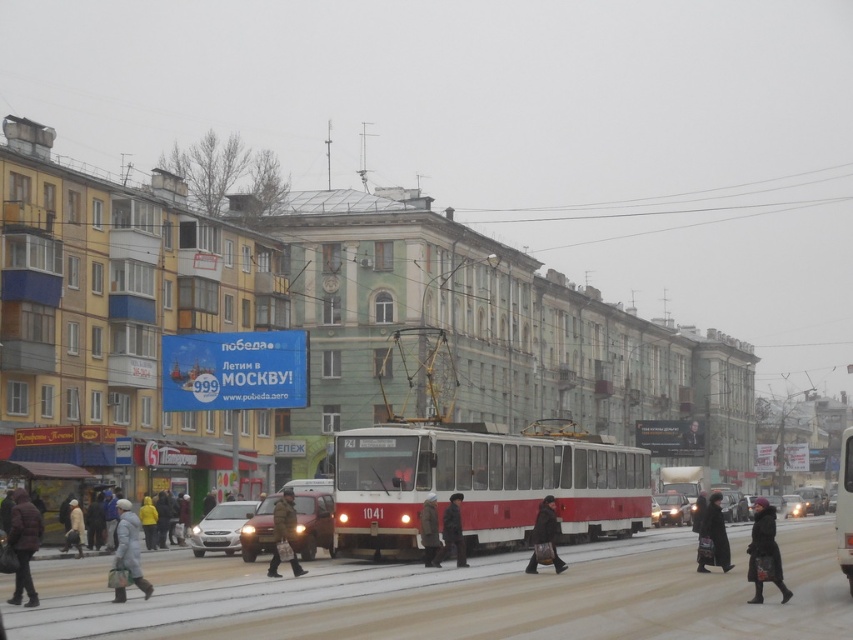
Between dark gray wool coat at lower right and satin silver sedan at lower left, which one is positioned lower?

dark gray wool coat at lower right is below.

Consider the image. Measure the distance from dark gray wool coat at lower right to satin silver sedan at lower left.

dark gray wool coat at lower right is 50.94 feet from satin silver sedan at lower left.

Who is more distant from viewer, (x=756, y=531) or (x=207, y=528)?

Point (x=207, y=528)

Where is `dark gray wool coat at lower right`? dark gray wool coat at lower right is located at coordinates (764, 552).

Can you confirm if dark brown fur coat at center is thinner than metallic silver car at center?

Indeed, dark brown fur coat at center has a lesser width compared to metallic silver car at center.

Does point (421, 540) come farther from viewer compared to point (785, 496)?

No, (421, 540) is in front of (785, 496).

I want to click on dark brown fur coat at center, so click(x=428, y=531).

Who is taller, dark gray wool coat at lower right or yellow matte jacket at lower left?

With more height is dark gray wool coat at lower right.

Can you confirm if dark gray wool coat at lower right is positioned above yellow matte jacket at lower left?

Indeed, dark gray wool coat at lower right is positioned over yellow matte jacket at lower left.

Locate an element on the screen. dark gray wool coat at lower right is located at coordinates (764, 552).